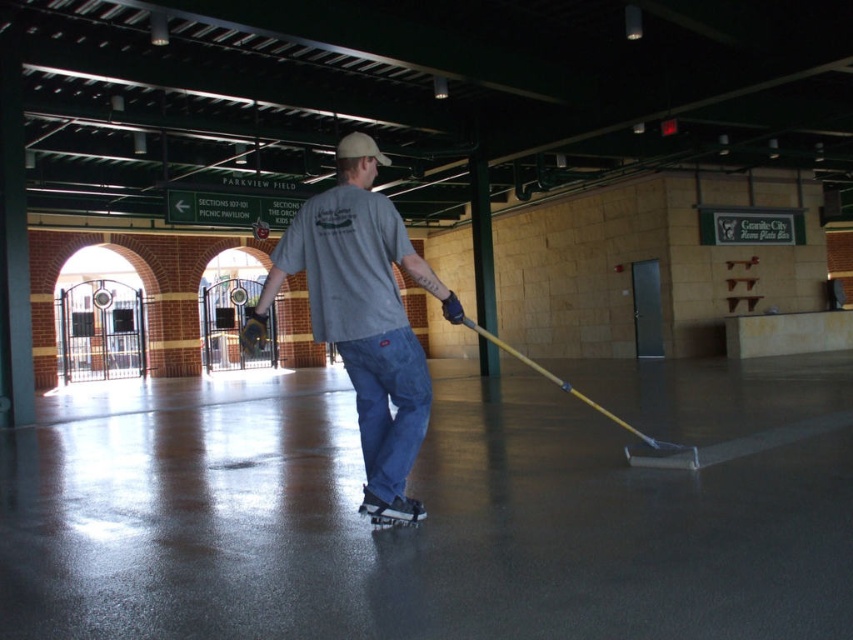
Question: Which point appears farthest from the camera in this image?

Choices:
 (A) (398, 355)
 (B) (393, 504)

Answer: (B)

Question: Which point is closer to the camera taking this photo?

Choices:
 (A) (375, 512)
 (B) (311, 230)

Answer: (B)

Question: Does denim pants at center have a lesser width compared to black rubber roller skate at center?

Choices:
 (A) yes
 (B) no

Answer: (B)

Question: Is denim pants at center positioned behind black rubber roller skate at center?

Choices:
 (A) yes
 (B) no

Answer: (B)

Question: Can you confirm if denim pants at center is thinner than black rubber roller skate at center?

Choices:
 (A) yes
 (B) no

Answer: (B)